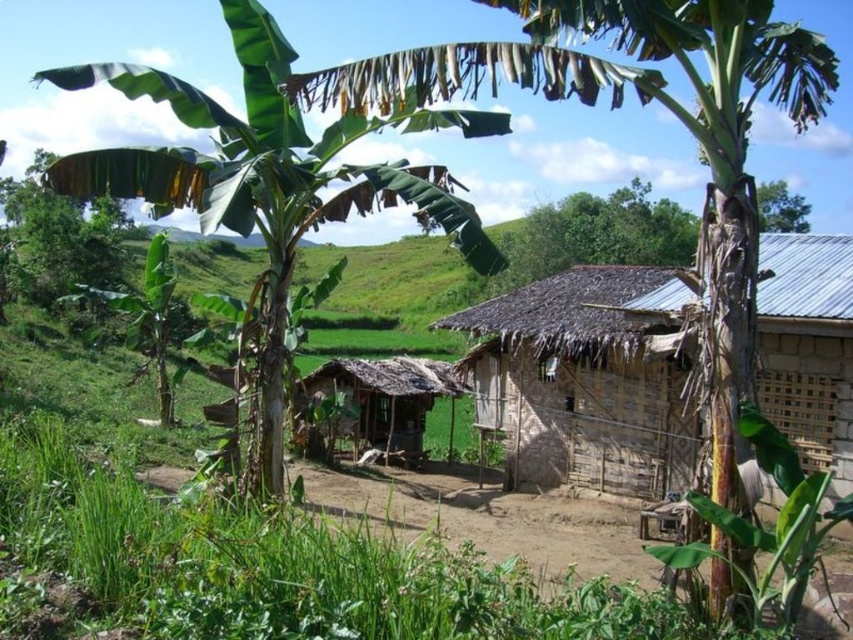
Question: Which object is farther from the camera taking this photo?

Choices:
 (A) green leafy tree at upper left
 (B) green leafy tree at upper center
 (C) rusty corrugated metal hut at center

Answer: (A)

Question: Does rusty corrugated metal hut at center have a smaller size compared to brown thatch hut at center?

Choices:
 (A) yes
 (B) no

Answer: (A)

Question: Which object is farther from the camera taking this photo?

Choices:
 (A) green leafy banana tree at upper left
 (B) rusty corrugated metal hut at center
 (C) green leafy tree at upper center
 (D) green leafy tree at upper left

Answer: (D)

Question: Is rusty corrugated metal hut at center closer to camera compared to brown thatch hut at center?

Choices:
 (A) no
 (B) yes

Answer: (B)

Question: Which point appears closest to the camera in this image?

Choices:
 (A) (778, 225)
 (B) (260, 483)

Answer: (B)

Question: From the image, what is the correct spatial relationship of green leafy tree at upper left in relation to green leafy tree at upper center?

Choices:
 (A) left
 (B) right

Answer: (A)